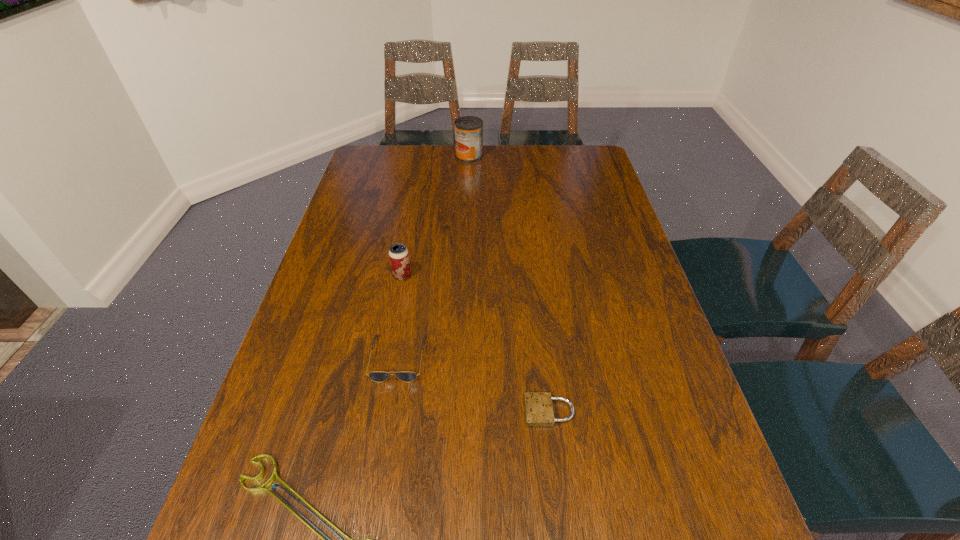
Identify the location of the tallest object. The height and width of the screenshot is (540, 960). (468, 129).

Where is `the farthest object`? the farthest object is located at coordinates (468, 129).

This screenshot has height=540, width=960. In order to click on beer can in this screenshot , I will do `click(399, 257)`.

Where is `the second tallest object`? The height and width of the screenshot is (540, 960). the second tallest object is located at coordinates (399, 257).

Locate an element on the screen. sunglasses is located at coordinates (377, 376).

Locate an element on the screen. Image resolution: width=960 pixels, height=540 pixels. the third nearest object is located at coordinates (377, 376).

The height and width of the screenshot is (540, 960). Identify the location of the second nearest object. (539, 412).

In order to click on the rightmost object in this screenshot , I will do `click(539, 412)`.

What are the coordinates of `vacant area situated on the left of the second object from right to left` in the screenshot? It's located at [x=397, y=156].

Locate an element on the screen. This screenshot has width=960, height=540. free location located on the back of the second farthest object is located at coordinates (418, 192).